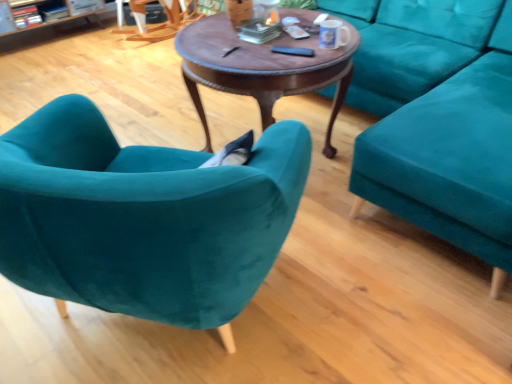
Where is `empty space that is in between white glossy mug at upper center and black matte remote control at center, which is the first remote control in front-to-back order`? empty space that is in between white glossy mug at upper center and black matte remote control at center, which is the first remote control in front-to-back order is located at coordinates click(x=310, y=54).